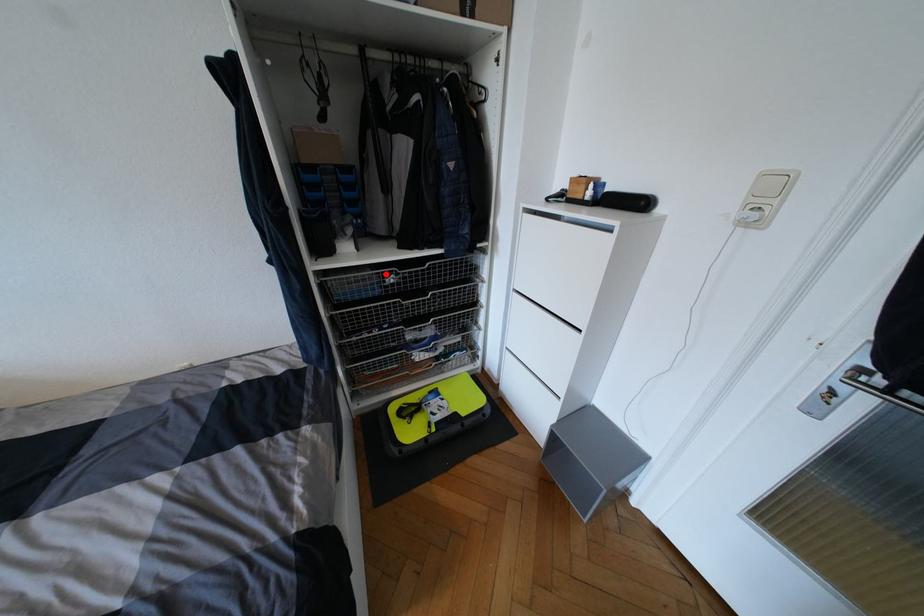
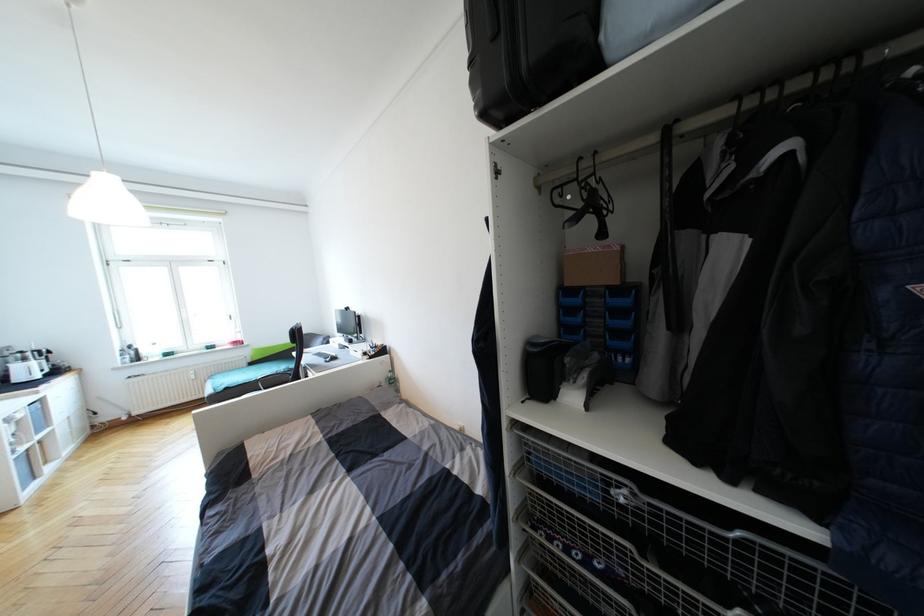
Question: A red point is marked in image1. In image2, is the corresponding 3D point closer to the camera or farther? Reply with the corresponding letter.

Choices:
 (A) The corresponding 3D point is closer.
 (B) The corresponding 3D point is farther.

Answer: (B)